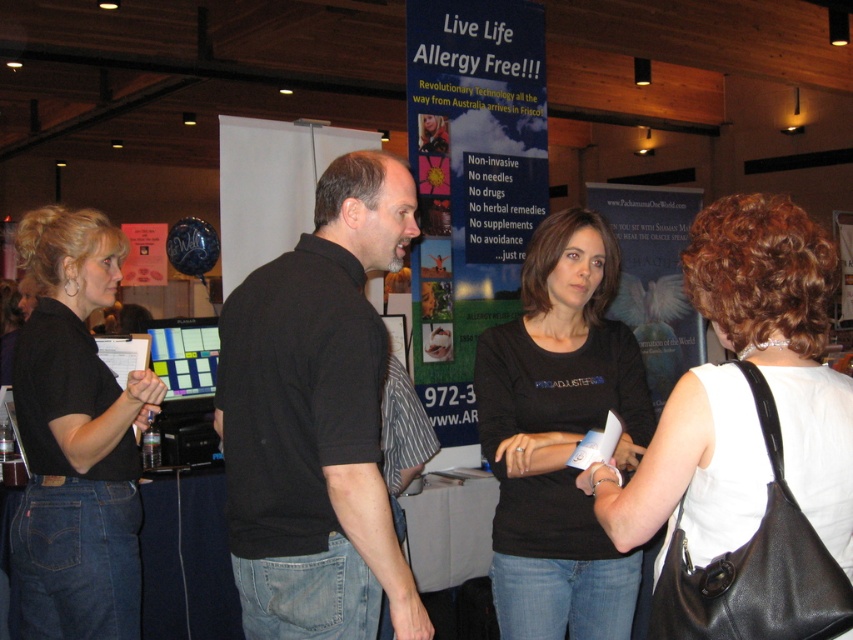
You are organizing a photo shoot and need to place a prop between the white leather purse at right and the black matte shirt at left. Based on their sizes, which object should the prop be placed closer to?

The prop should be placed closer to the black matte shirt at left because the white leather purse at right is smaller than the black matte shirt at left, so the larger object requires more space around it.

You are at a trade show and see two people wearing black shirts at the center of the image. Which one is wearing the black cotton shirt at center located to the left of the black matte shirt at center?

The black cotton shirt at center is positioned on the left side of the black matte shirt at center, so the person wearing the black cotton shirt at center is to the left of the other.